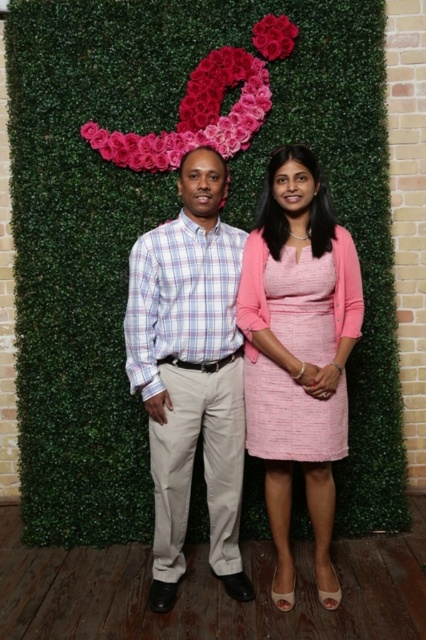
You are planning to take a photo of the two people in the scene. The photographer wants to ensure that both the pink floral decoration at upper center and the smooth pink roses at upper center are clearly visible in the frame. Given their sizes, which one should be placed closer to the camera to maintain clarity and focus?

The smooth pink roses at upper center should be placed closer to the camera because the pink floral decoration at upper center is larger in size. By positioning the smaller roses closer, they can be captured with clear focus while the larger decoration remains in the background, ensuring both elements are visible and in focus.

Consider the image. You are a photographer setting up for a portrait. You want to ensure the subjects are well lit. The pink floral decoration at upper center and the smooth pink roses at upper center are both in the frame. Which object should you adjust the lighting for to avoid casting a shadow on the subjects?

The pink floral decoration at upper center is much taller than the smooth pink roses at upper center, so adjusting the lighting for the pink floral decoration at upper center would be necessary to avoid its shadow falling on the subjects.

You are a photographer setting up for a portrait. You want to ensure the two subjects, the pink floral decoration at upper center and the smooth pink roses at upper center, are in focus. The camera has a depth of field that can cover 10 inches. Can both subjects be in focus at the same time?

The pink floral decoration at upper center is 9.09 inches from smooth pink roses at upper center. Since the distance between them is less than the camera depth of field of 10 inches, both subjects can be in focus at the same time.